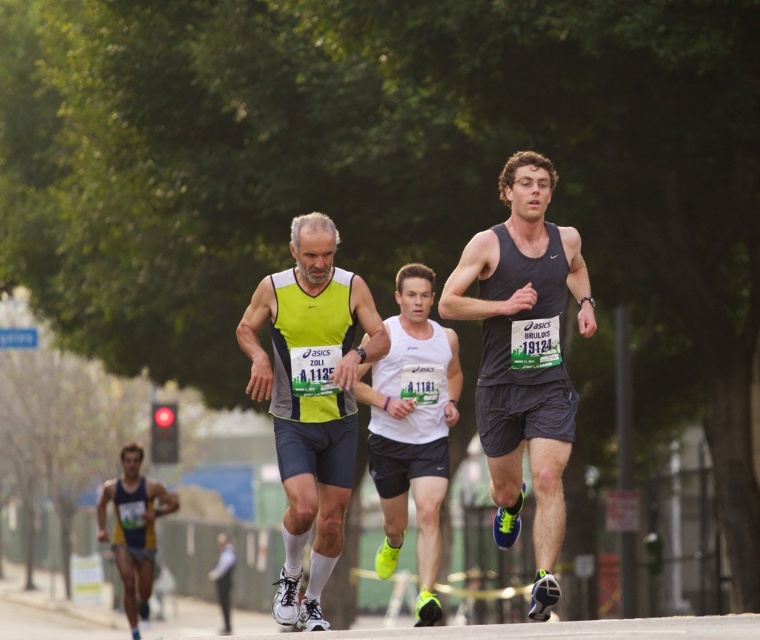
Does point (524, 346) lie behind point (394, 524)?

No, it is not.

Between point (570, 392) and point (429, 592), which one is positioned behind?

Positioned behind is point (429, 592).

What are the coordinates of `dark gray tank top at center` in the screenshot? It's located at (524, 356).

Can you confirm if neon yellow fabric tank top at center is positioned above white matte tank top at center?

Incorrect, neon yellow fabric tank top at center is not positioned above white matte tank top at center.

Does point (372, 326) come closer to viewer compared to point (385, 552)?

Yes, it is.

Between point (363, 300) and point (410, 305), which one is positioned in front?

Positioned in front is point (363, 300).

The image size is (760, 640). I want to click on neon yellow fabric tank top at center, so click(x=309, y=397).

Does neon yellow fabric tank top at center have a larger size compared to blue and yellow athletic wear at lower left?

Actually, neon yellow fabric tank top at center might be smaller than blue and yellow athletic wear at lower left.

Looking at this image, between neon yellow fabric tank top at center and blue and yellow athletic wear at lower left, which one has more height?

Standing taller between the two is blue and yellow athletic wear at lower left.

Identify the location of neon yellow fabric tank top at center. (309, 397).